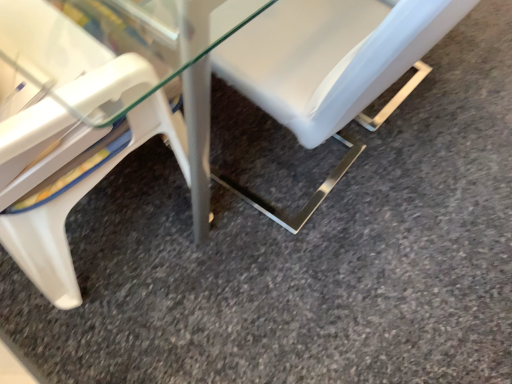
Question: Are white plastic chair at center, the 2th chair viewed from the left, and white plastic chair at lower left, which is the 1th chair from left to right, beside each other?

Choices:
 (A) no
 (B) yes

Answer: (A)

Question: From a real-world perspective, is white plastic chair at center, the 2th chair viewed from the left, physically below white plastic chair at lower left, which is the 1th chair from left to right?

Choices:
 (A) yes
 (B) no

Answer: (A)

Question: Considering the relative sizes of white plastic chair at center, the 2th chair viewed from the left, and white plastic chair at lower left, which is the 1th chair from left to right, in the image provided, is white plastic chair at center, the 2th chair viewed from the left, smaller than white plastic chair at lower left, which is the 1th chair from left to right,?

Choices:
 (A) yes
 (B) no

Answer: (A)

Question: Does white plastic chair at center, the 2th chair viewed from the left, have a greater height compared to white plastic chair at lower left, the 2th chair in the right-to-left sequence?

Choices:
 (A) yes
 (B) no

Answer: (B)

Question: From the image's perspective, is white plastic chair at center, which is the first chair in right-to-left order, located above white plastic chair at lower left, which is the 1th chair from left to right?

Choices:
 (A) yes
 (B) no

Answer: (A)

Question: Is white plastic chair at center, the 2th chair viewed from the left, not inside white plastic chair at lower left, which is the 1th chair from left to right?

Choices:
 (A) no
 (B) yes

Answer: (B)

Question: From the image's perspective, would you say white plastic chair at lower left, the 2th chair in the right-to-left sequence, is shown under white plastic chair at center, the 2th chair viewed from the left?

Choices:
 (A) yes
 (B) no

Answer: (A)

Question: Considering the relative positions of white plastic chair at lower left, which is the 1th chair from left to right, and white plastic chair at center, which is the first chair in right-to-left order, in the image provided, is white plastic chair at lower left, which is the 1th chair from left to right, to the left of white plastic chair at center, which is the first chair in right-to-left order, from the viewer's perspective?

Choices:
 (A) yes
 (B) no

Answer: (A)

Question: Is white plastic chair at lower left, which is the 1th chair from left to right, not inside white plastic chair at center, which is the first chair in right-to-left order?

Choices:
 (A) no
 (B) yes

Answer: (B)

Question: From a real-world perspective, is white plastic chair at lower left, the 2th chair in the right-to-left sequence, located beneath white plastic chair at center, the 2th chair viewed from the left?

Choices:
 (A) yes
 (B) no

Answer: (B)

Question: Can white plastic chair at center, which is the first chair in right-to-left order, be found inside white plastic chair at lower left, the 2th chair in the right-to-left sequence?

Choices:
 (A) no
 (B) yes

Answer: (A)

Question: Does white plastic chair at lower left, which is the 1th chair from left to right, have a greater height compared to white plastic chair at center, which is the first chair in right-to-left order?

Choices:
 (A) no
 (B) yes

Answer: (B)

Question: Considering the positions of white plastic chair at lower left, which is the 1th chair from left to right, and white plastic chair at center, the 2th chair viewed from the left, in the image, is white plastic chair at lower left, which is the 1th chair from left to right, bigger or smaller than white plastic chair at center, the 2th chair viewed from the left,?

Choices:
 (A) big
 (B) small

Answer: (A)